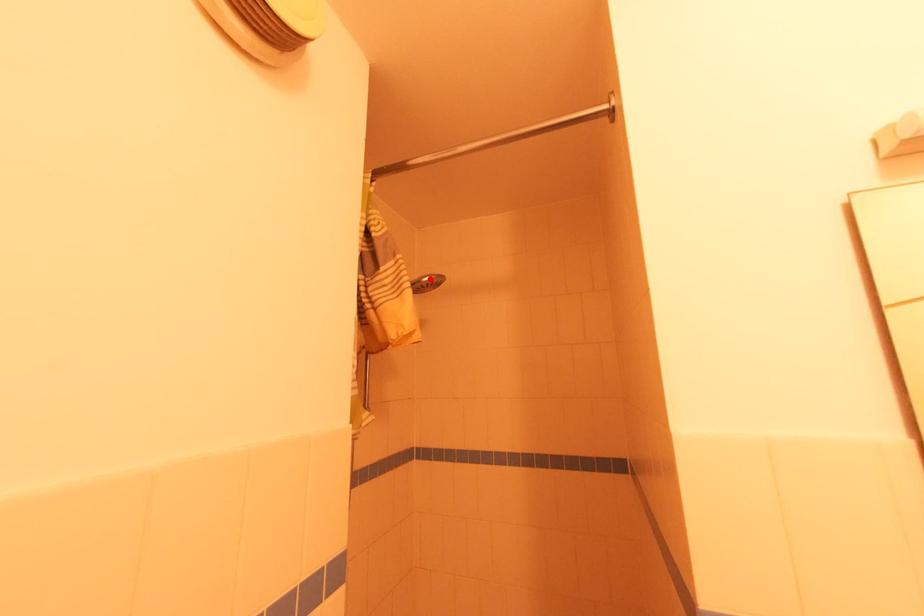
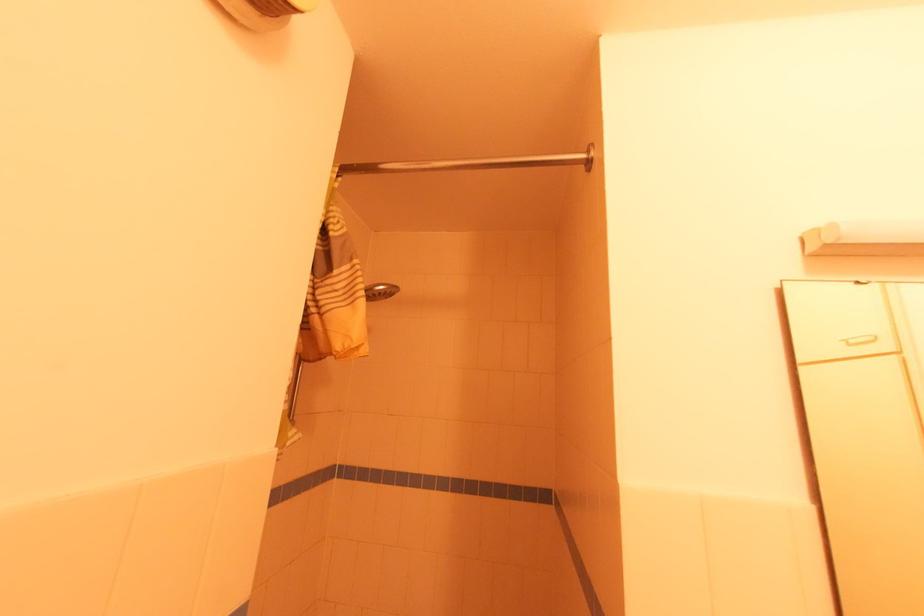
Find the pixel in the second image that matches the highlighted location in the first image.

(383, 288)